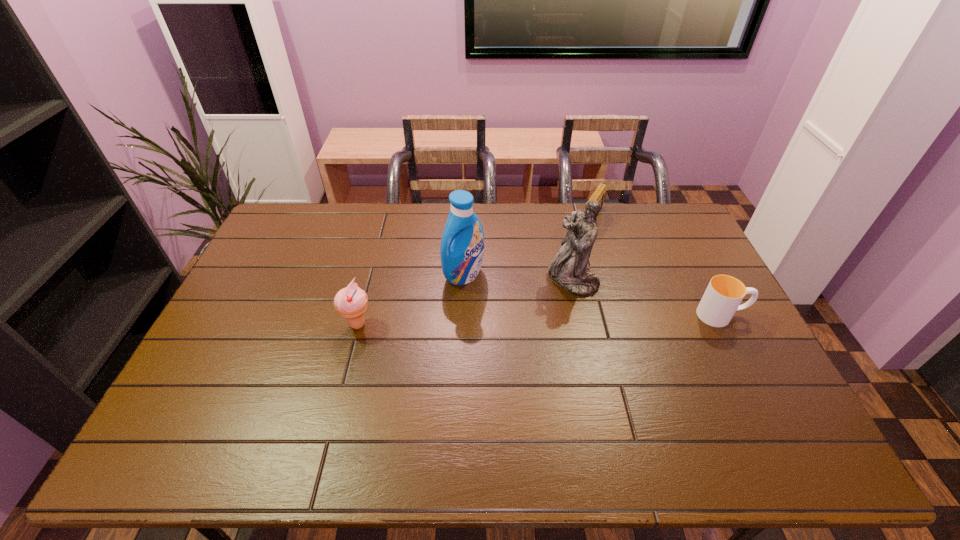
In order to click on free location located at the barrel of the farthest object in this screenshot , I will do `click(561, 273)`.

I want to click on vacant space located 0.270m at the barrel of the farthest object, so click(561, 273).

This screenshot has height=540, width=960. I want to click on free space located at the barrel of the farthest object, so click(x=551, y=288).

This screenshot has height=540, width=960. I want to click on vacant space located 0.130m on the front-facing side of the fourth object from right to left, so click(504, 307).

The height and width of the screenshot is (540, 960). In order to click on free space located 0.350m on the front-facing side of the fourth object from right to left in this screenshot , I will do `click(557, 353)`.

Where is `vacant space situated on the front-facing side of the fourth object from right to left`? vacant space situated on the front-facing side of the fourth object from right to left is located at coordinates (495, 300).

The image size is (960, 540). Find the location of `object that is at the far edge`. object that is at the far edge is located at coordinates (598, 195).

In order to click on object positioned at the right edge in this screenshot , I will do `click(722, 298)`.

I want to click on vacant space at the far edge of the desktop, so click(572, 208).

Find the location of a particular element. vacant space at the near edge is located at coordinates (533, 391).